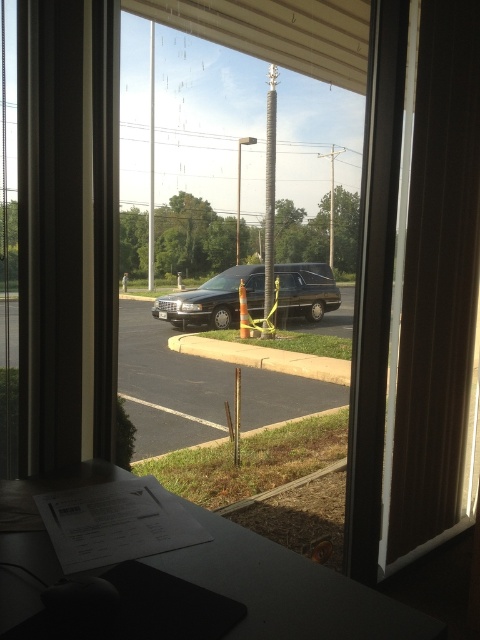
Question: Does black glossy car at center appear under black matte hearse at center?

Choices:
 (A) no
 (B) yes

Answer: (B)

Question: From the image, what is the correct spatial relationship of black glossy car at center in relation to black matte hearse at center?

Choices:
 (A) above
 (B) below

Answer: (B)

Question: In this image, where is black glossy car at center located relative to black matte hearse at center?

Choices:
 (A) left
 (B) right

Answer: (B)